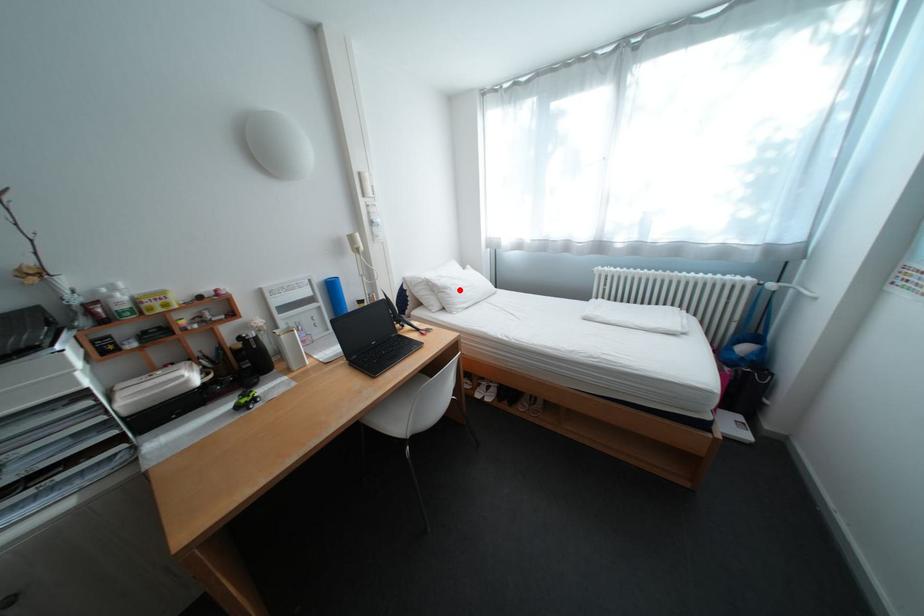
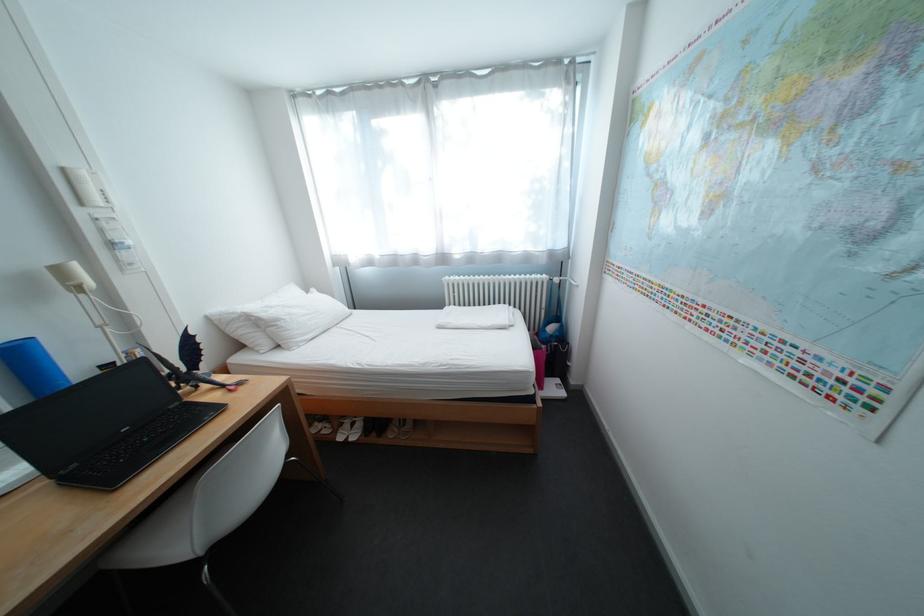
Where in the second image is the point corresponding to the highlighted location from the first image?

(292, 322)